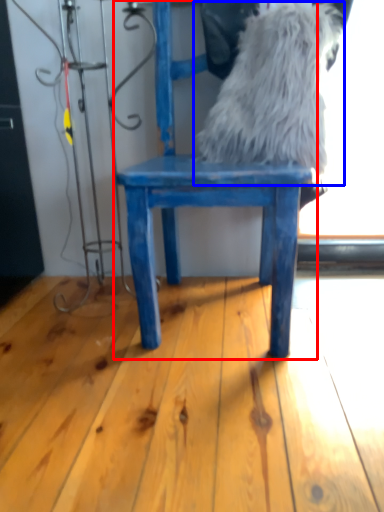
Question: Which object appears farthest to the camera in this image, chair (highlighted by a red box) or animal (highlighted by a blue box)?

Choices:
 (A) chair
 (B) animal

Answer: (B)